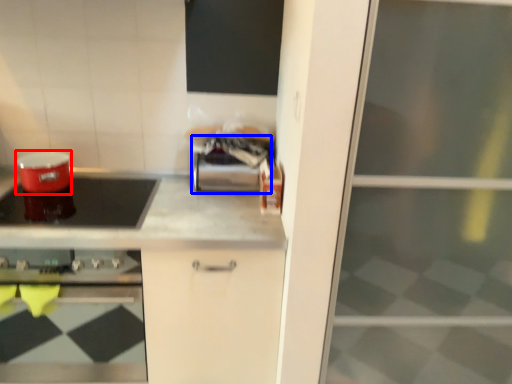
Question: Which object appears farthest to the camera in this image, appliance (highlighted by a red box) or appliance (highlighted by a blue box)?

Choices:
 (A) appliance
 (B) appliance

Answer: (B)